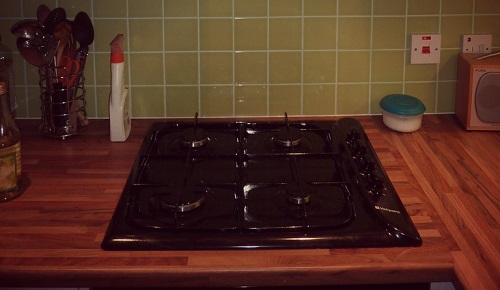
Locate an element on the screen. The height and width of the screenshot is (290, 500). knobs is located at coordinates (353, 140), (360, 156), (366, 172), (375, 191).